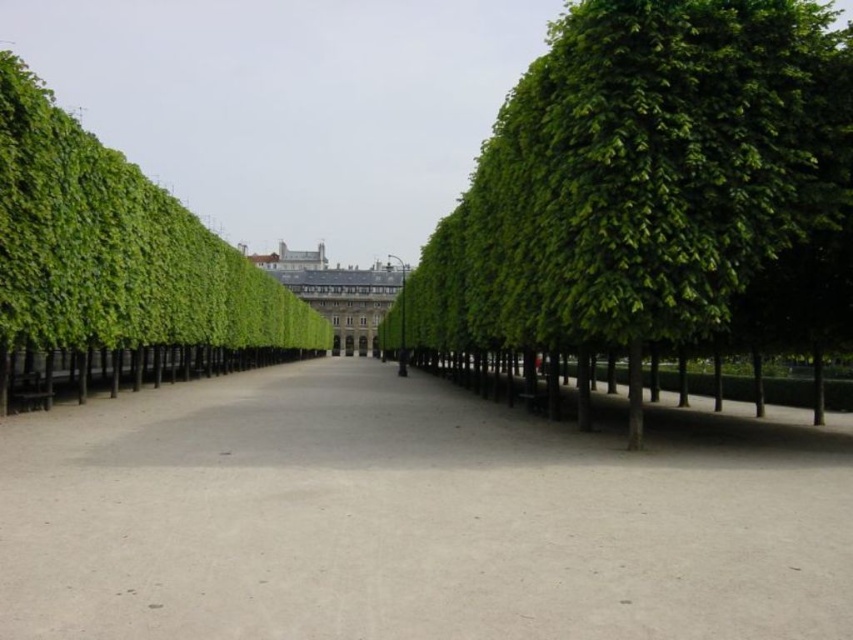
You are standing at the entrance of the pathway and want to walk straight ahead. According to the image, will the gray concrete alley at center be visible above or below the green leafy tree at center as you walk forward?

The gray concrete alley at center is positioned under the green leafy tree at center, so as you walk forward, the gray concrete alley at center will be visible below the green leafy tree at center.

You are a delivery person with a 1.2 meter wide cart. You need to navigate through the gray concrete alley at center and the white stone building at center. Which path can your cart safely pass through?

The gray concrete alley at center is thinner than the white stone building at center. Since your cart is 1.2 meters wide, you can safely pass through the white stone building at center, which is wider than the alley.

You are standing at the starting point of the pathway and see the point at coordinate [407,518]. What is located at that point?

The point at coordinate [407,518] corresponds to the gray concrete alley at center.